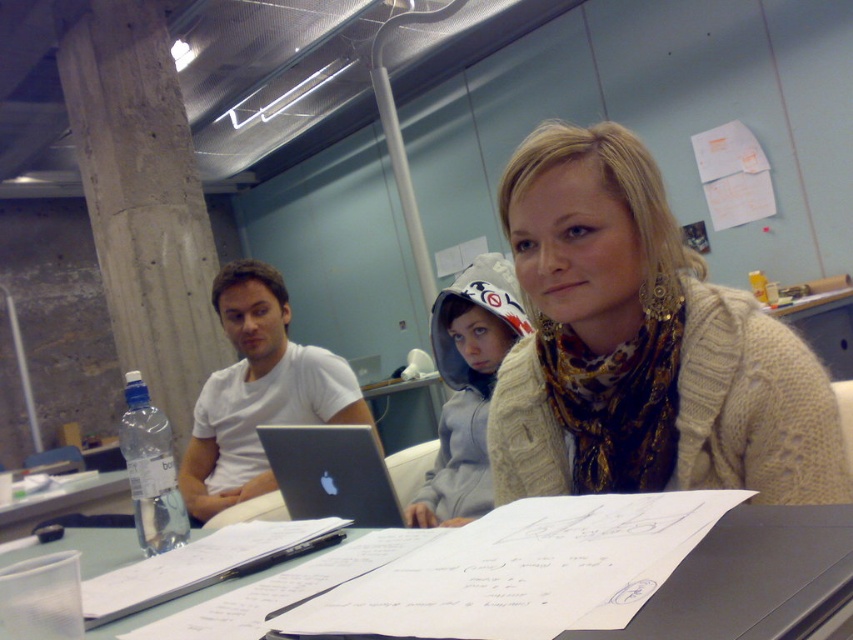
Question: Is white matte shirt at center closer to camera compared to clear plastic bottle at lower left?

Choices:
 (A) no
 (B) yes

Answer: (A)

Question: Which object is positioned closest to the floral scarf at center?

Choices:
 (A) knitted beige sweater at center
 (B) silver metallic laptop at center

Answer: (B)

Question: Can you confirm if silver metallic laptop at center is positioned above clear plastic bottle at lower left?

Choices:
 (A) yes
 (B) no

Answer: (A)

Question: Which is nearer to the knitted beige sweater at center?

Choices:
 (A) white paper at center
 (B) concrete at left

Answer: (A)

Question: Among these objects, which one is nearest to the camera?

Choices:
 (A) concrete at left
 (B) white paper at center
 (C) knitted beige sweater at center
 (D) clear plastic bottle at lower left

Answer: (B)

Question: Does concrete at left have a smaller size compared to silver metallic laptop at center?

Choices:
 (A) yes
 (B) no

Answer: (B)